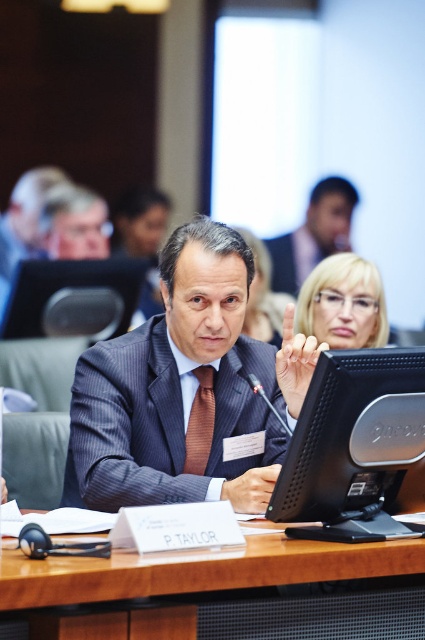
Question: Is matte black suit at upper center smaller than brown striped tie at center?

Choices:
 (A) no
 (B) yes

Answer: (A)

Question: Is matte black headset at upper left wider than brown striped tie at center?

Choices:
 (A) no
 (B) yes

Answer: (B)

Question: Which is farther from the matte blue pinstripe suit at center?

Choices:
 (A) matte black suit at upper center
 (B) dark gray pinstripe suit at center

Answer: (A)

Question: Which object is closer to the camera taking this photo?

Choices:
 (A) brown striped tie at center
 (B) matte black headset at upper left
 (C) black plastic monitor at center
 (D) wooden table at center

Answer: (D)

Question: Among these objects, which one is farthest from the camera?

Choices:
 (A) matte black suit at upper center
 (B) brown striped tie at center
 (C) black plastic monitor at center

Answer: (A)

Question: Is wooden table at center above matte black headset at upper left?

Choices:
 (A) yes
 (B) no

Answer: (B)